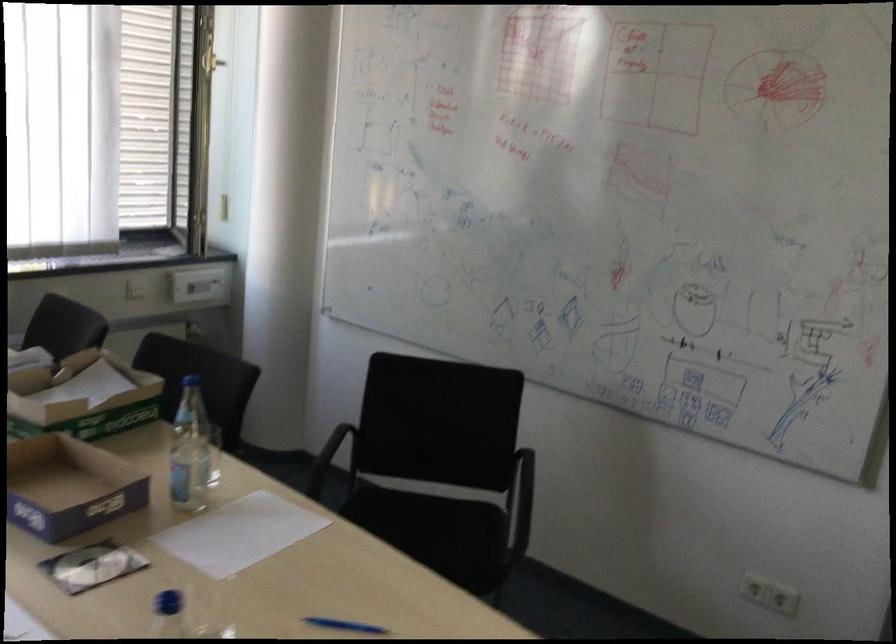
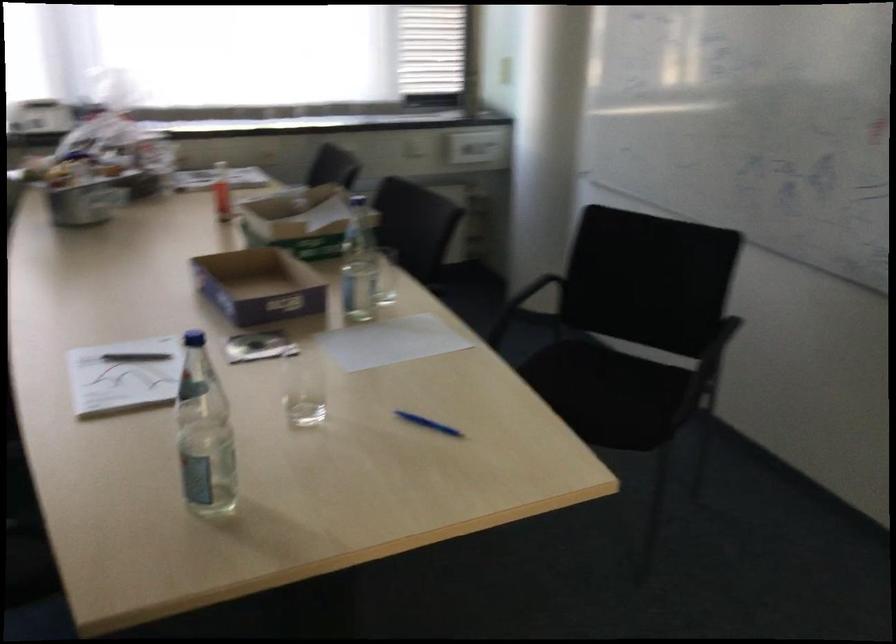
Question: The images are taken continuously from a first-person perspective. In which direction are you moving?

Choices:
 (A) Left
 (B) Right
 (C) Forward
 (D) Backward

Answer: (B)